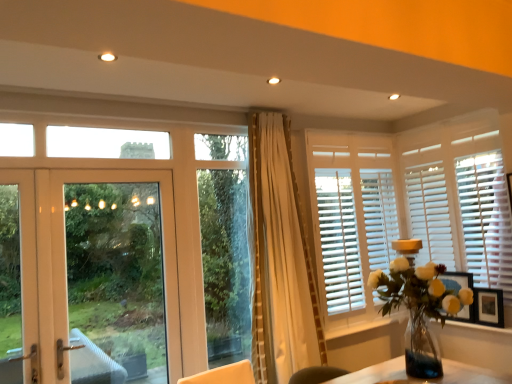
The width and height of the screenshot is (512, 384). I want to click on free spot above white wood blinds at right (from a real-world perspective), so click(x=441, y=114).